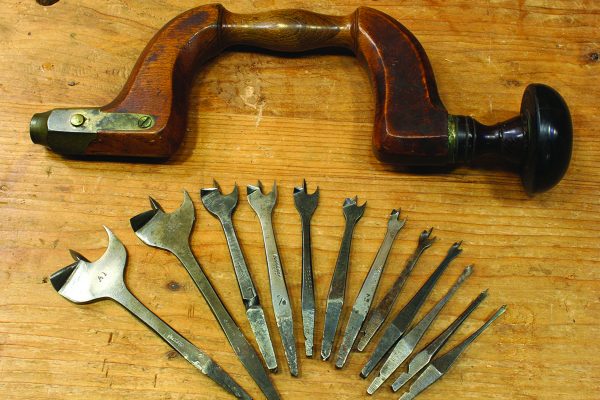
Image resolution: width=600 pixels, height=400 pixels. Identify the location of wooden table. (273, 132).